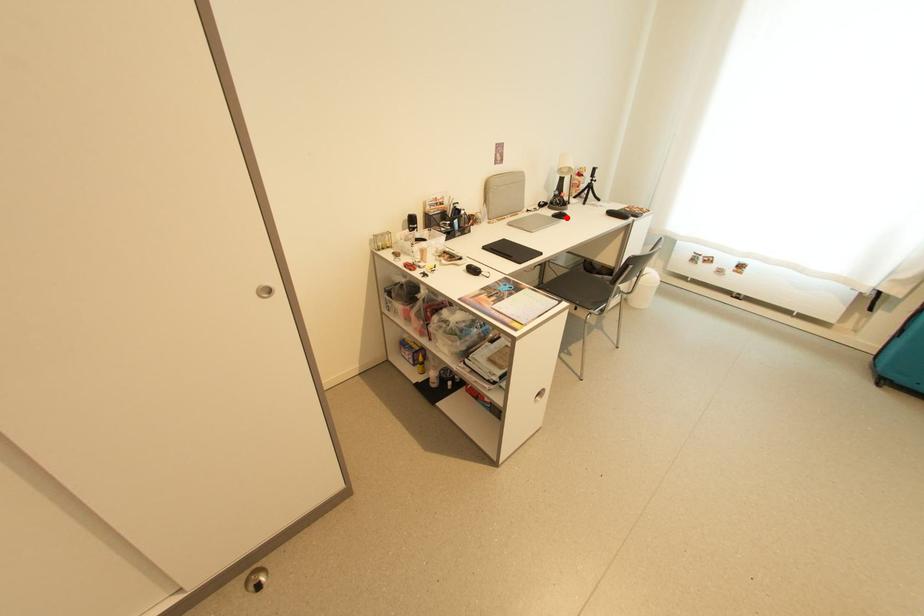
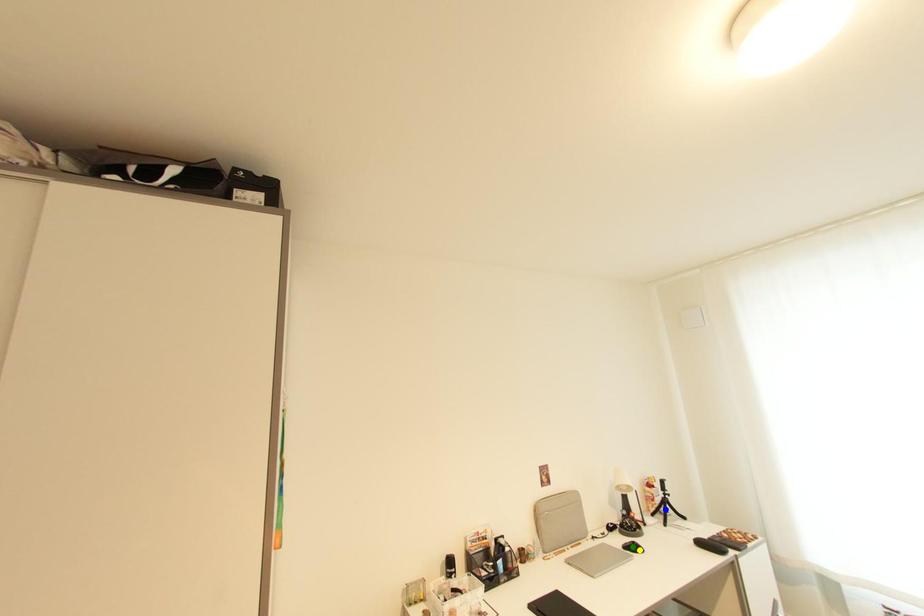
Question: I am providing you with two images of the same scene from different viewpoints. A red point is marked on the first image. You are given multiple points on the second image. Which mark in image 2 goes with the point in image 1?

Choices:
 (A) green point
 (B) blue point
 (C) yellow point

Answer: (C)